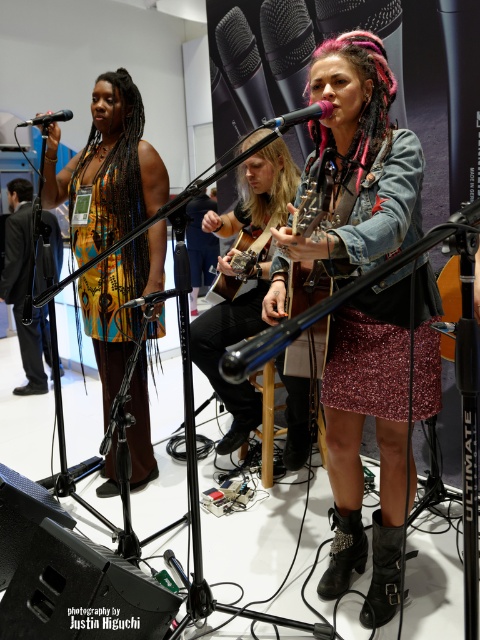
Question: Which of these objects is positioned farthest from the black matte microphone at center?

Choices:
 (A) black leather jacket at left
 (B) denim jacket at center
 (C) matte black microphone at upper left

Answer: (A)

Question: Which point is closer to the camera?

Choices:
 (A) (288, 387)
 (B) (326, 108)
 (C) (151, 180)

Answer: (B)

Question: Is black leather jacket at left further to the viewer compared to matte black microphone at upper left?

Choices:
 (A) no
 (B) yes

Answer: (B)

Question: Is denim jacket at center closer to camera compared to black matte microphone at center?

Choices:
 (A) yes
 (B) no

Answer: (A)

Question: Which of the following is the farthest from the observer?

Choices:
 (A) matte black microphone at upper left
 (B) denim jacket at center
 (C) metallic silver microphone at center

Answer: (B)

Question: Is the position of black leather jacket at left more distant than that of metallic silver microphone at center?

Choices:
 (A) no
 (B) yes

Answer: (B)